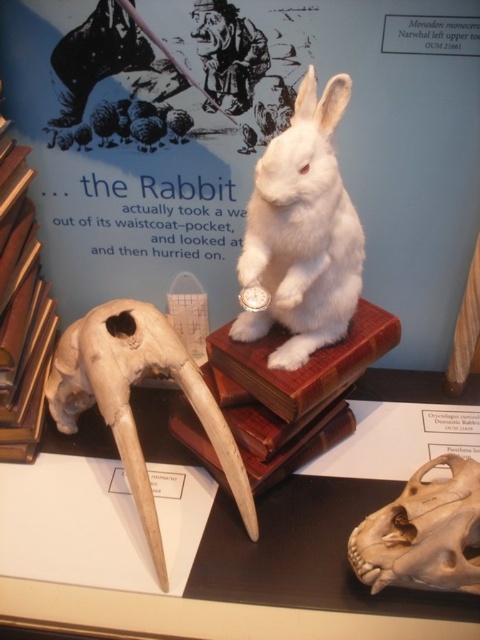
Question: Which object is the farthest from the brown bone skull at lower right?

Choices:
 (A) white plush rabbit at center
 (B) brown leather book at left

Answer: (B)

Question: Does brown bone skull at lower right appear over brown leather book at left?

Choices:
 (A) yes
 (B) no

Answer: (B)

Question: Which point appears farthest from the camera in this image?

Choices:
 (A) (46, 348)
 (B) (336, 228)
 (C) (56, 394)
 (D) (479, 524)

Answer: (A)

Question: Does white matte skull at lower left have a larger size compared to brown bone skull at lower right?

Choices:
 (A) yes
 (B) no

Answer: (A)

Question: Can you confirm if white plush rabbit at center is positioned below white matte skull at lower left?

Choices:
 (A) no
 (B) yes

Answer: (A)

Question: Which point is closer to the camera?

Choices:
 (A) (360, 545)
 (B) (267, 250)
 (C) (149, 330)

Answer: (A)